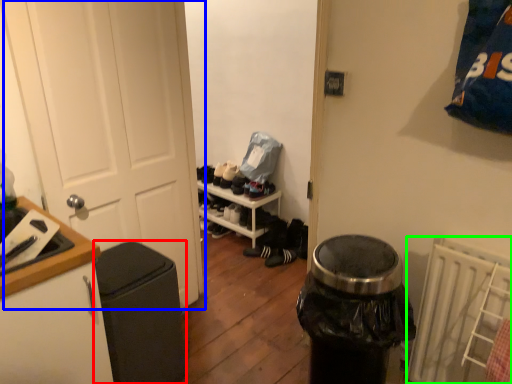
Question: Which object is positioned closest to garbage (highlighted by a red box)? Select from door (highlighted by a blue box) and radiator (highlighted by a green box).

Choices:
 (A) door
 (B) radiator

Answer: (A)